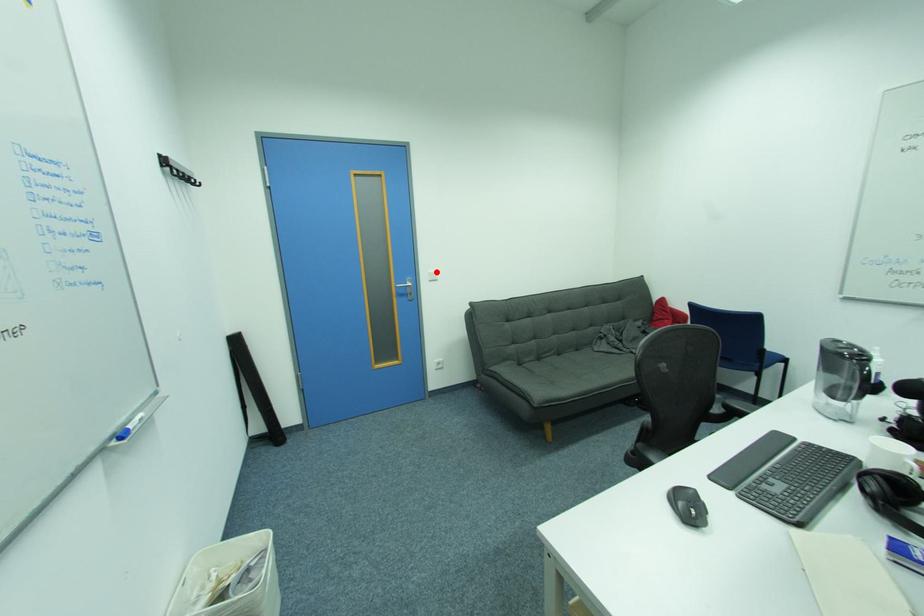
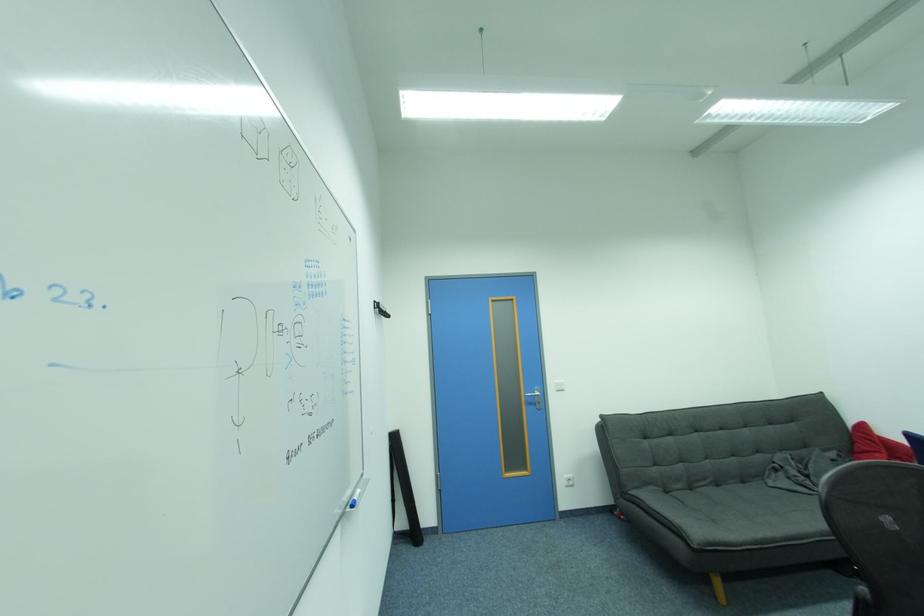
Find the pixel in the second image that matches the highlighted location in the first image.

(564, 382)